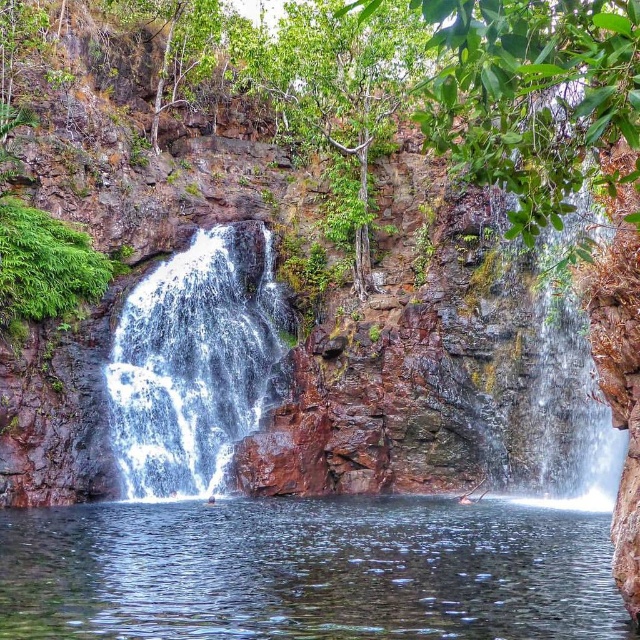
Question: Which point is closer to the camera?

Choices:
 (A) white frothy water at center left
 (B) clear water at center

Answer: (B)

Question: Among these objects, which one is nearest to the camera?

Choices:
 (A) clear water at center
 (B) white frothy water at center left

Answer: (A)

Question: Is clear water at center above white frothy water at center left?

Choices:
 (A) yes
 (B) no

Answer: (B)

Question: Can you confirm if clear water at center is bigger than white frothy water at center left?

Choices:
 (A) no
 (B) yes

Answer: (A)

Question: Is the position of clear water at center more distant than that of white frothy water at center left?

Choices:
 (A) no
 (B) yes

Answer: (A)